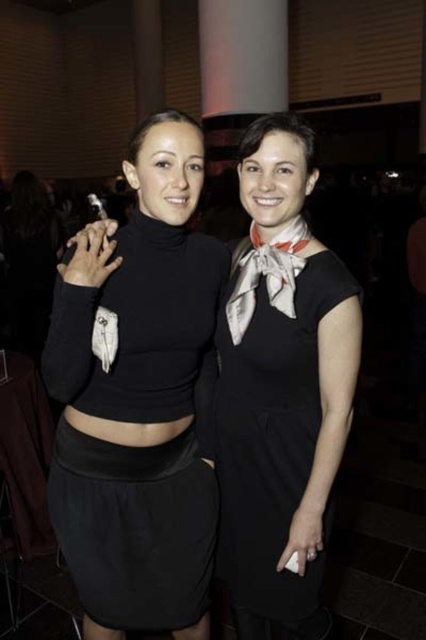
Question: Does black matte turtleneck at center lie behind black satin dress at center?

Choices:
 (A) no
 (B) yes

Answer: (A)

Question: Can you confirm if black matte turtleneck at center is wider than black satin dress at center?

Choices:
 (A) yes
 (B) no

Answer: (A)

Question: Can you confirm if black matte turtleneck at center is thinner than black satin dress at center?

Choices:
 (A) no
 (B) yes

Answer: (A)